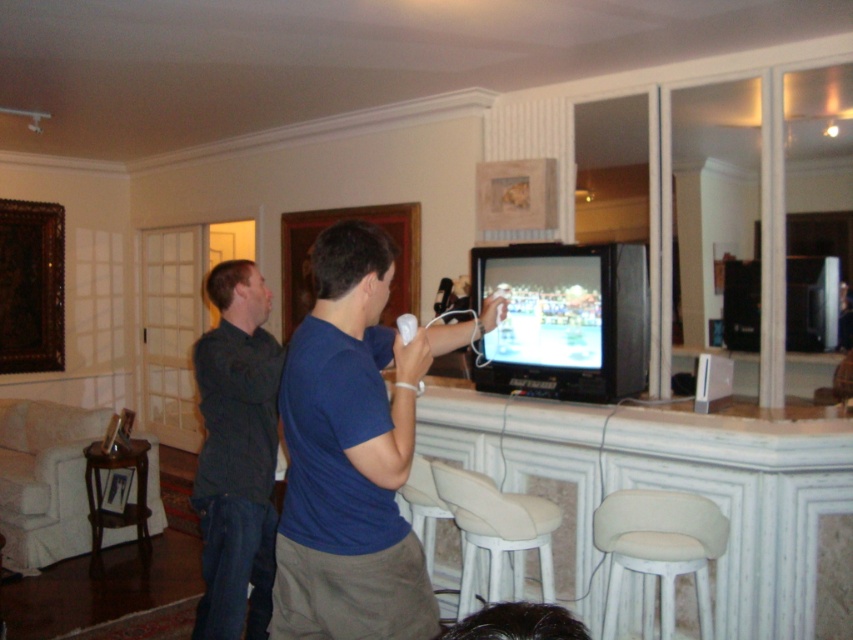
Question: Is beige fabric stool at lower center thinner than brown wooden bar stool at lower left?

Choices:
 (A) no
 (B) yes

Answer: (A)

Question: Which is nearer to the brown wooden bar stool at lower left?

Choices:
 (A) white fabric bar stool at lower right
 (B) white matte remote at center
 (C) beige fabric stool at lower center
 (D) blue cotton shirt at center

Answer: (C)

Question: Is blue cotton shirt at center to the left of brown wooden bar stool at lower left from the viewer's perspective?

Choices:
 (A) no
 (B) yes

Answer: (A)

Question: Which point appears closest to the camera in this image?

Choices:
 (A) (99, 522)
 (B) (659, 545)
 (C) (428, 464)
 (D) (241, 532)

Answer: (D)

Question: Is white fabric bar stool at lower right thinner than beige fabric stool at lower center?

Choices:
 (A) yes
 (B) no

Answer: (A)

Question: Which point is closer to the camera taking this photo?

Choices:
 (A) (624, 547)
 (B) (363, 380)
 (C) (215, 545)

Answer: (B)